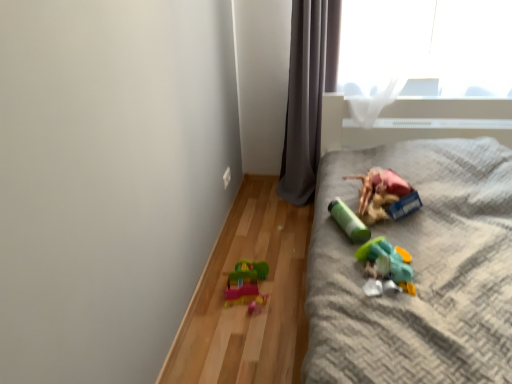
Image resolution: width=512 pixels, height=384 pixels. I want to click on vacant area that lies in front of translucent plastic toy at lower left, the 1th toy viewed from the left, so click(x=247, y=333).